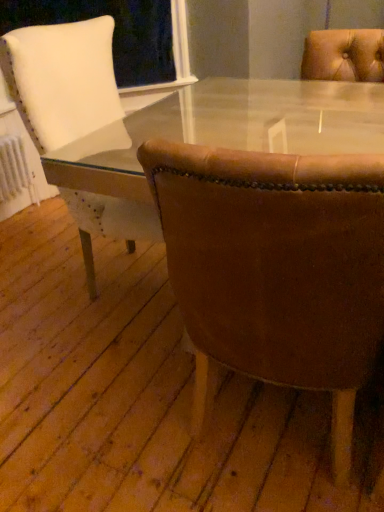
Question: From the image's perspective, relative to brown leather chair at center, marked as the 1th chair in a right-to-left arrangement, is leather at right, which is the first chair from left to right, above or below?

Choices:
 (A) above
 (B) below

Answer: (A)

Question: Is point (81, 101) closer or farther from the camera than point (317, 281)?

Choices:
 (A) farther
 (B) closer

Answer: (A)

Question: Is leather at right, the second chair viewed from the right, spatially inside brown leather chair at center, which ranks as the second chair in left-to-right order, or outside of it?

Choices:
 (A) outside
 (B) inside

Answer: (A)

Question: Is brown leather chair at center, marked as the 1th chair in a right-to-left arrangement, situated inside leather at right, which is the first chair from left to right, or outside?

Choices:
 (A) inside
 (B) outside

Answer: (B)

Question: Is brown leather chair at center, which ranks as the second chair in left-to-right order, bigger or smaller than leather at right, the second chair viewed from the right?

Choices:
 (A) big
 (B) small

Answer: (B)

Question: In terms of width, does brown leather chair at center, marked as the 1th chair in a right-to-left arrangement, look wider or thinner when compared to leather at right, which is the first chair from left to right?

Choices:
 (A) wide
 (B) thin

Answer: (B)

Question: Is point (296, 290) closer or farther from the camera than point (36, 45)?

Choices:
 (A) farther
 (B) closer

Answer: (B)